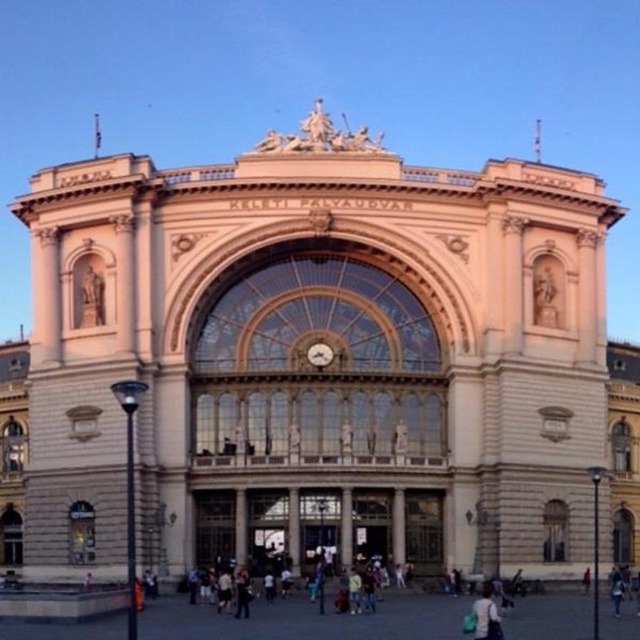
Is light blue fabric bag at lower center wider than gold metallic clock at center?

Yes.

Locate an element on the screen. light blue fabric bag at lower center is located at coordinates (486, 616).

Does light blue fabric bag at lower center have a smaller size compared to beige stone pillar at center?

No.

Does light blue fabric bag at lower center have a greater height compared to beige stone pillar at center?

Yes.

The image size is (640, 640). Describe the element at coordinates (486, 616) in the screenshot. I see `light blue fabric bag at lower center` at that location.

Find the location of a particular element. The width and height of the screenshot is (640, 640). light blue fabric bag at lower center is located at coordinates (486, 616).

Which is in front, point (346, 560) or point (321, 364)?

Point (346, 560) is more forward.

Between point (340, 552) and point (328, 358), which one is positioned behind?

The point (328, 358) is more distant.

The height and width of the screenshot is (640, 640). In order to click on beige stone pillar at center in this screenshot , I will do `click(346, 528)`.